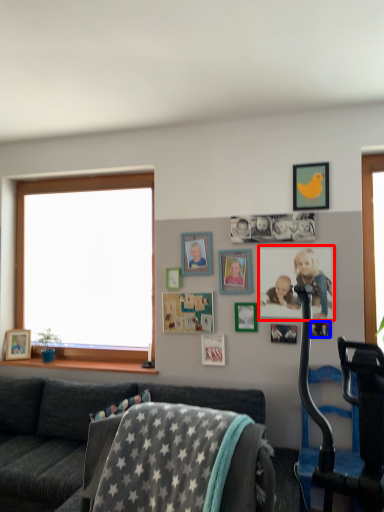
Question: Which of the following is the closest to the observer, picture frame (highlighted by a red box) or picture frame (highlighted by a blue box)?

Choices:
 (A) picture frame
 (B) picture frame

Answer: (A)